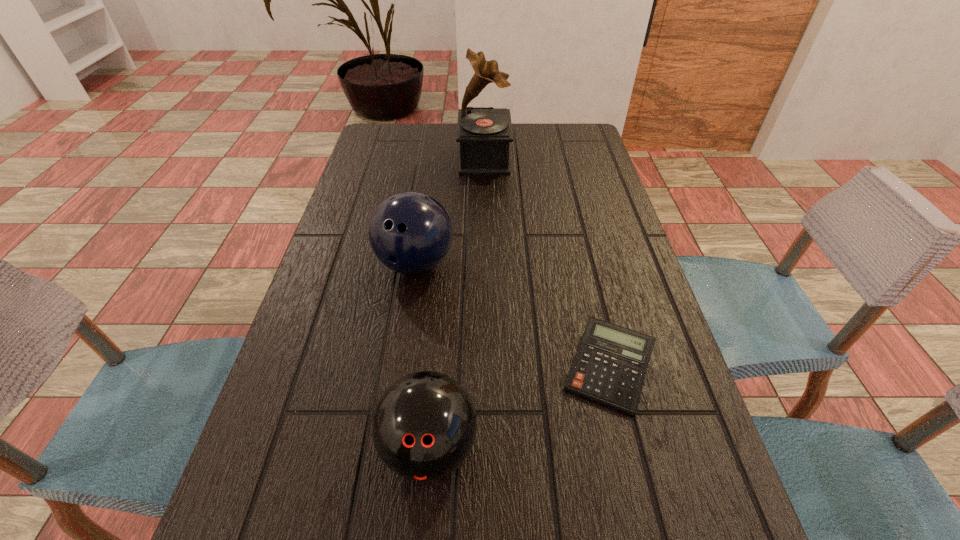
Where is `vacant area that lies between the farthest object and the farther bowling ball`? vacant area that lies between the farthest object and the farther bowling ball is located at coordinates (449, 211).

Find the location of `vacant region between the farther bowling ball and the calculator`. vacant region between the farther bowling ball and the calculator is located at coordinates (512, 316).

This screenshot has width=960, height=540. What are the coordinates of `free space between the phonograph_record and the calculator` in the screenshot? It's located at (546, 264).

You are a GUI agent. You are given a task and a screenshot of the screen. Output one action in this format:
    pyautogui.click(x=<x>, y=<y>)
    Task: Click on the free spot between the third tallest object and the farther bowling ball
    The height and width of the screenshot is (540, 960).
    Given the screenshot: What is the action you would take?
    pyautogui.click(x=422, y=355)

Identify the location of free space between the phonograph_record and the third nearest object. The height and width of the screenshot is (540, 960). (449, 211).

At what (x,y) coordinates should I click in order to perform the action: click on empty location between the farthest object and the second shortest object. Please return your answer as a coordinate pair (x, y). Looking at the image, I should click on tap(457, 303).

Identify the location of free space that is in between the second shortest object and the calculator. This screenshot has height=540, width=960. (519, 408).

Locate which object is the second closest to the nearer bowling ball. Please provide its 2D coordinates. Your answer should be formatted as a tuple, i.e. [(x, y)], where the tuple contains the x and y coordinates of a point satisfying the conditions above.

[(410, 232)]

This screenshot has width=960, height=540. I want to click on object that is the nearest to the third tallest object, so click(x=609, y=368).

Identify the location of vacant point that satisfies the following two spatial constraints: 1. on the surface of the farther bowling ball near the finger holes; 2. on the left side of the shortest object. Image resolution: width=960 pixels, height=540 pixels. (399, 368).